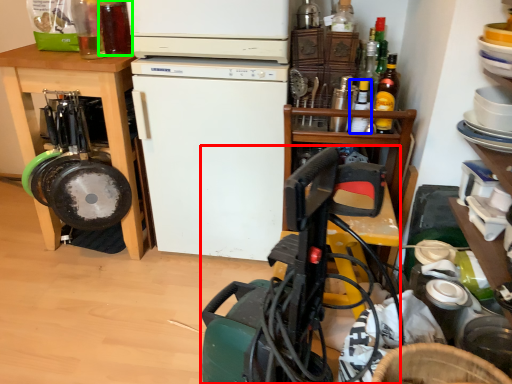
Question: Estimate the real-world distances between objects in this image. Which object is closer to appliance (highlighted by a red box), bottle (highlighted by a blue box) or bottle (highlighted by a green box)?

Choices:
 (A) bottle
 (B) bottle

Answer: (A)